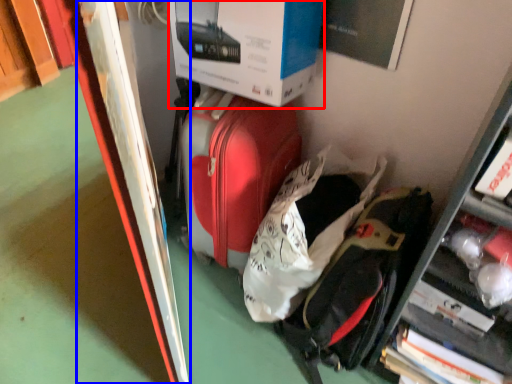
Question: Which point is further to the camera, box (highlighted by a red box) or bulletin board (highlighted by a blue box)?

Choices:
 (A) box
 (B) bulletin board

Answer: (A)